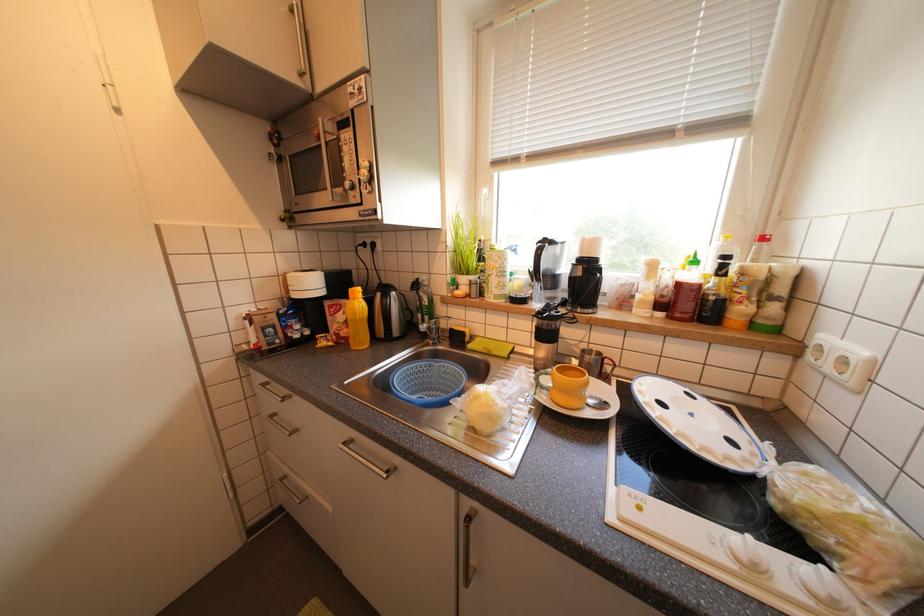
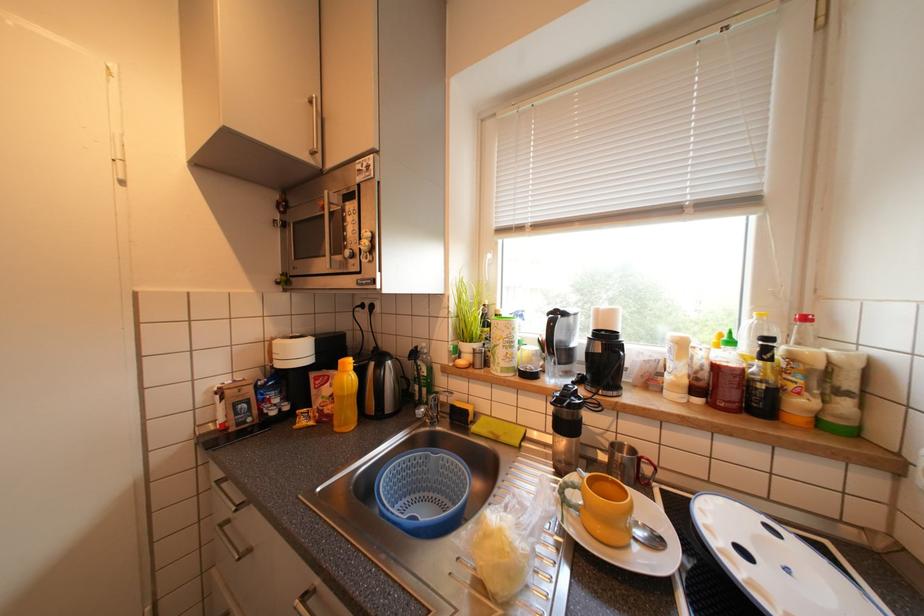
Question: Which direction would the cameraman need to move to produce the second image? Reply with the corresponding letter.

Choices:
 (A) Left
 (B) Right
 (C) Forward
 (D) Backward

Answer: (C)